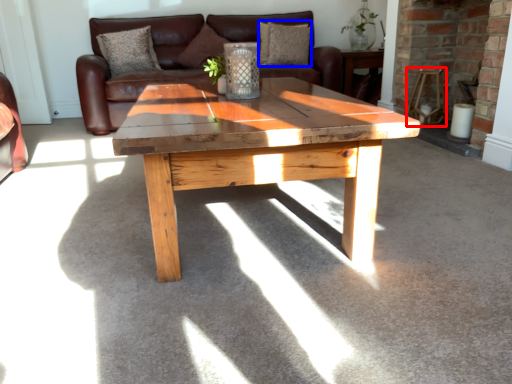
Question: Which of the following is the closest to the observer, chair (highlighted by a red box) or pillow (highlighted by a blue box)?

Choices:
 (A) chair
 (B) pillow

Answer: (A)